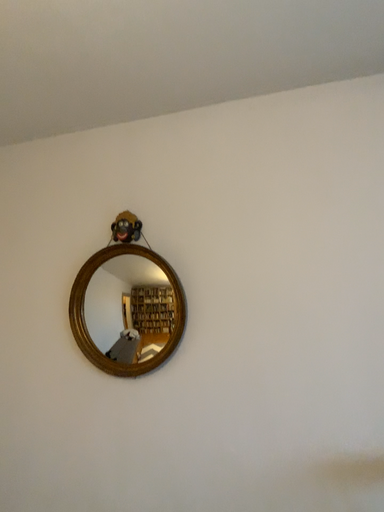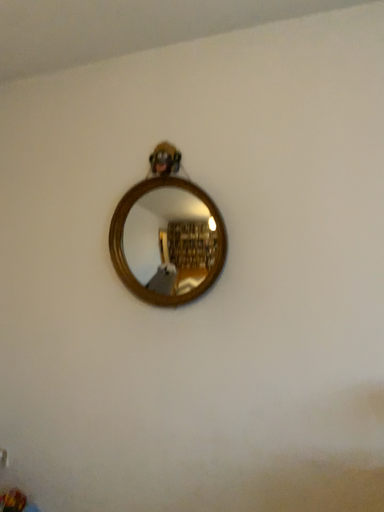
Question: Which way did the camera rotate in the video?

Choices:
 (A) rotated downward
 (B) rotated upward

Answer: (A)